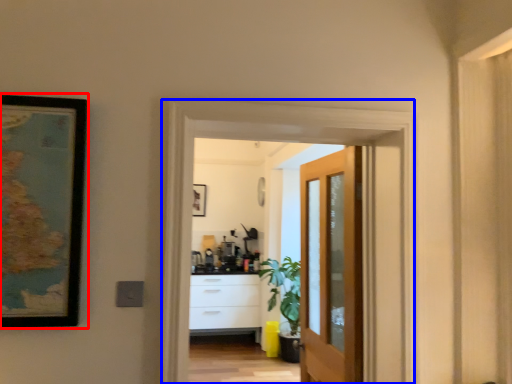
Question: Which of the following is the farthest to the observer, picture frame (highlighted by a red box) or screen door (highlighted by a blue box)?

Choices:
 (A) picture frame
 (B) screen door

Answer: (B)